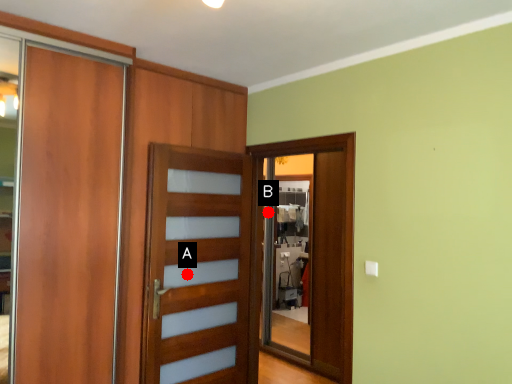
Question: Two points are circled on the image, labeled by A and B beside each circle. Which point is further to the camera?

Choices:
 (A) A is further
 (B) B is further

Answer: (B)